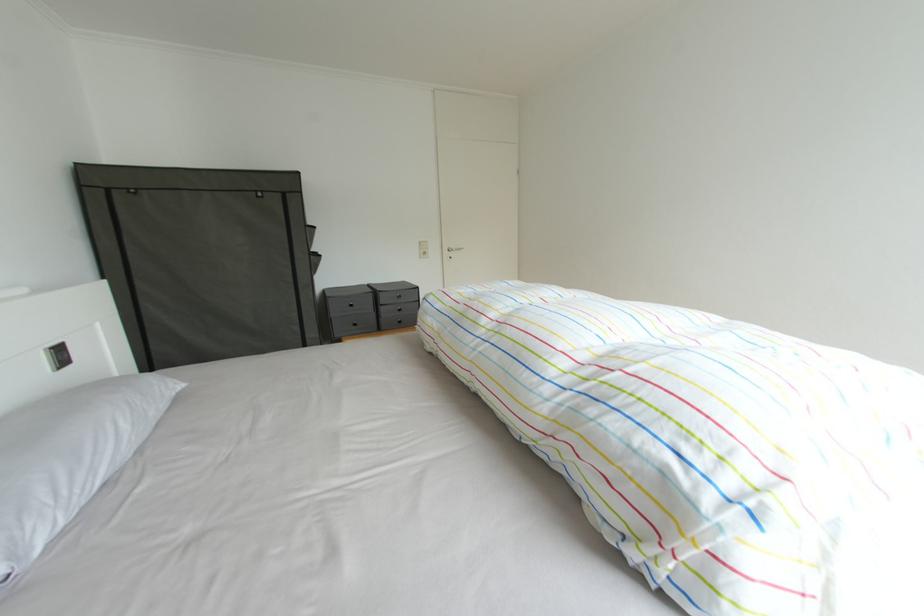
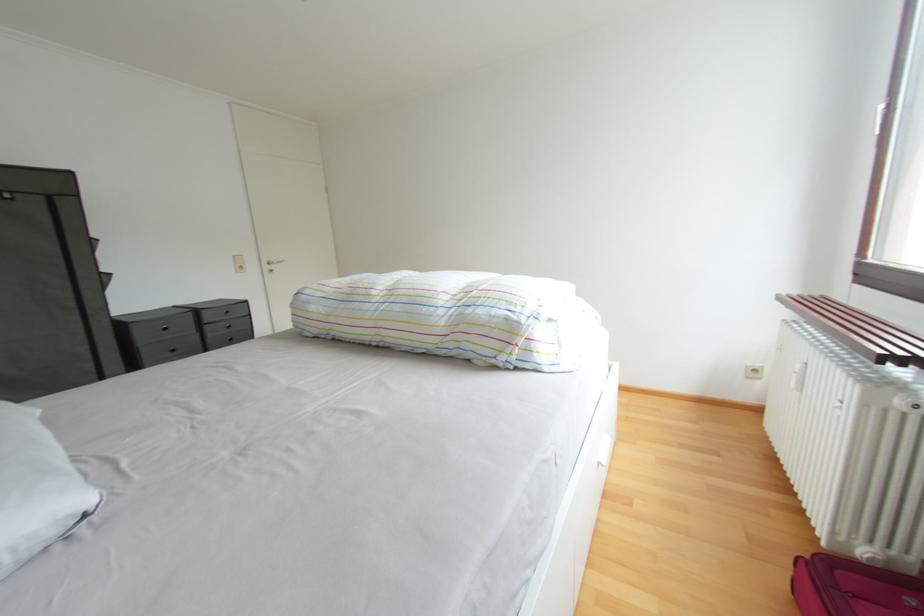
Question: The camera is either moving clockwise (left) or counter-clockwise (right) around the object. The first image is from the beginning of the video and the second image is from the end. Is the camera moving left or right when shooting the video?

Choices:
 (A) Left
 (B) Right

Answer: (A)